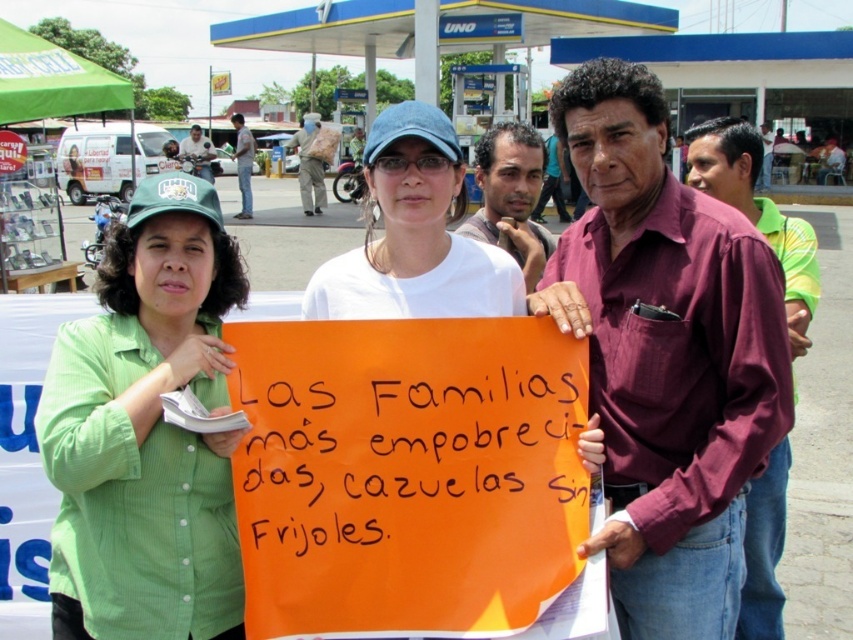
You are a photographer trying to capture a photo of the dark blue jeans at upper center and the dark brown leather jacket at center. If you want to ensure both items are fully visible in the frame, which item requires more horizontal space in the camera viewfinder?

The dark blue jeans at upper center requires more horizontal space in the camera viewfinder because its width is larger than the dark brown leather jacket at center.